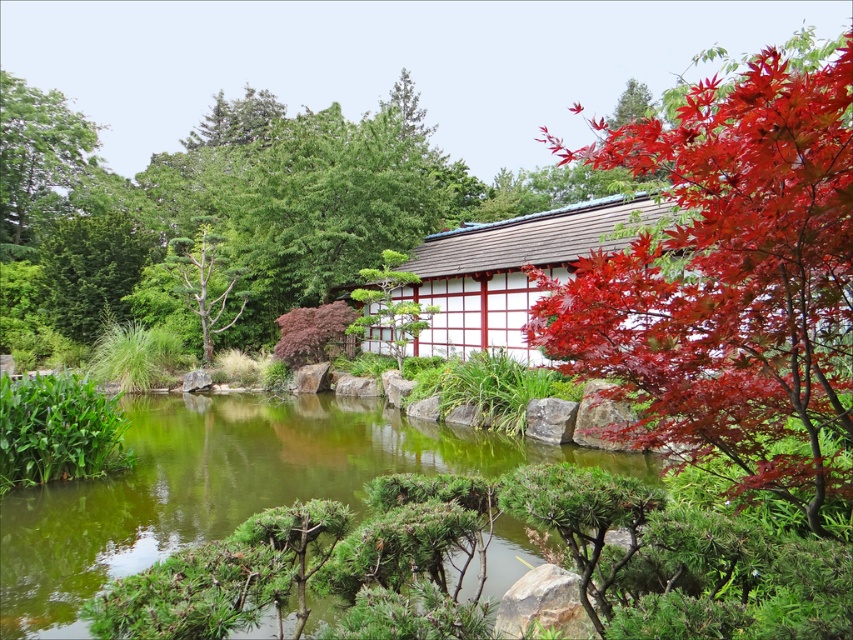
Question: Is green leafy tree at upper left smaller than bare wood tree at center-left?

Choices:
 (A) no
 (B) yes

Answer: (A)

Question: Is green leafy stream at center bigger than bare wood tree at center-left?

Choices:
 (A) no
 (B) yes

Answer: (B)

Question: Which point is farther to the camera?

Choices:
 (A) green leafy stream at center
 (B) green matte tree at center
 (C) shiny red maple at upper right

Answer: (B)

Question: Which object is farther from the camera taking this photo?

Choices:
 (A) green leafy tree at upper left
 (B) green leafy stream at center
 (C) green matte tree at center

Answer: (A)

Question: Does green leafy stream at center appear over green leafy tree at upper left?

Choices:
 (A) no
 (B) yes

Answer: (A)

Question: Which point appears closest to the camera in this image?

Choices:
 (A) (39, 220)
 (B) (44, 136)

Answer: (A)